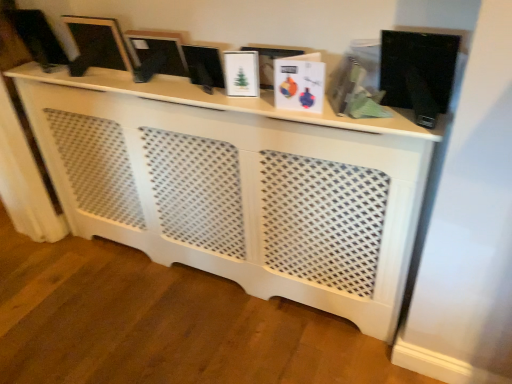
Question: Relative to matte black monitor at upper left, marked as the 3th computer monitor in a right-to-left arrangement, is black glossy computer monitor at center, which is the 3th computer monitor from left to right, in front or behind?

Choices:
 (A) behind
 (B) front

Answer: (B)

Question: Is black glossy computer monitor at center, which is the 3th computer monitor from left to right, to the left or to the right of matte black monitor at upper left, which is the 1th computer monitor in left-to-right order, in the image?

Choices:
 (A) left
 (B) right

Answer: (B)

Question: Which of these objects is positioned farthest from the matte black frame at upper left, the second computer monitor viewed from the right?

Choices:
 (A) black glossy computer monitor at center, which is the 3th computer monitor from left to right
 (B) matte black monitor at upper left, marked as the 3th computer monitor in a right-to-left arrangement
 (C) white lattice cabinet at center

Answer: (C)

Question: Considering the real-world distances, which object is farthest from the black glossy computer monitor at center, which is the 3th computer monitor from left to right?

Choices:
 (A) white lattice cabinet at center
 (B) matte black monitor at upper left, which is the 1th computer monitor in left-to-right order
 (C) matte black frame at upper left, the second computer monitor viewed from the left

Answer: (B)